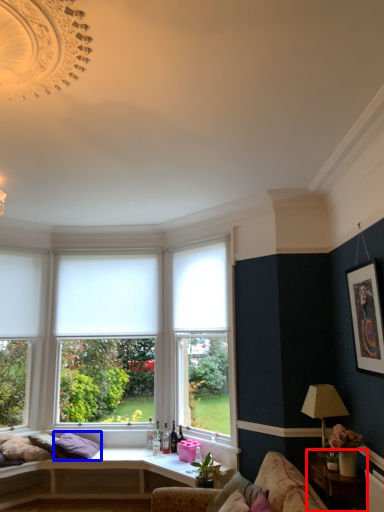
Question: Which of the following is the farthest to the observer, table (highlighted by a red box) or pillow (highlighted by a blue box)?

Choices:
 (A) table
 (B) pillow

Answer: (B)